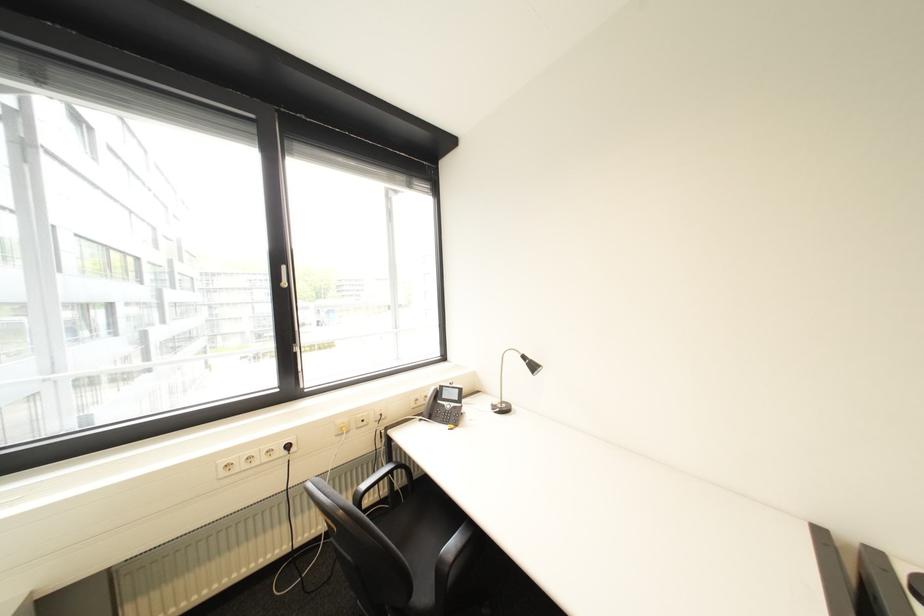
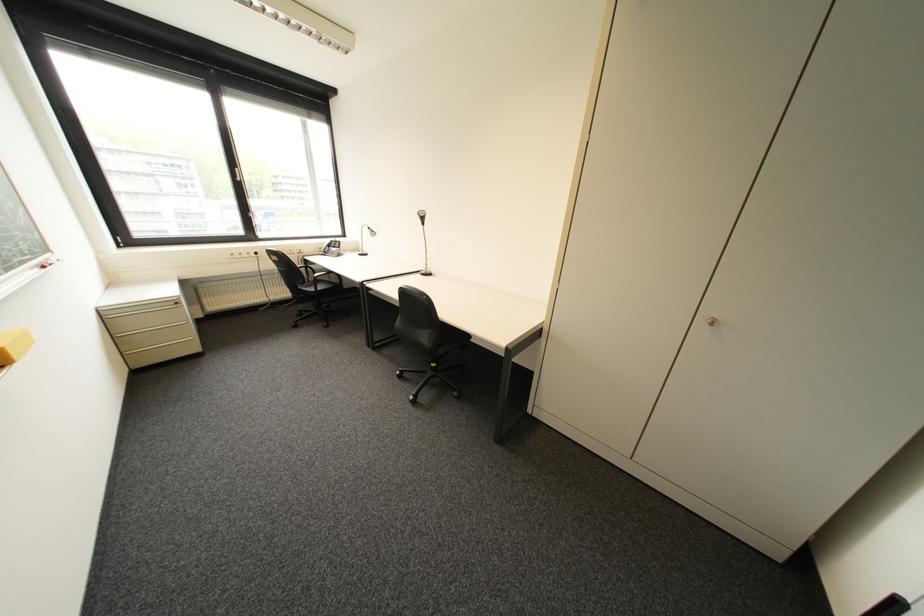
Locate, in the second image, the point that corresponds to (x=295, y=285) in the first image.

(249, 180)